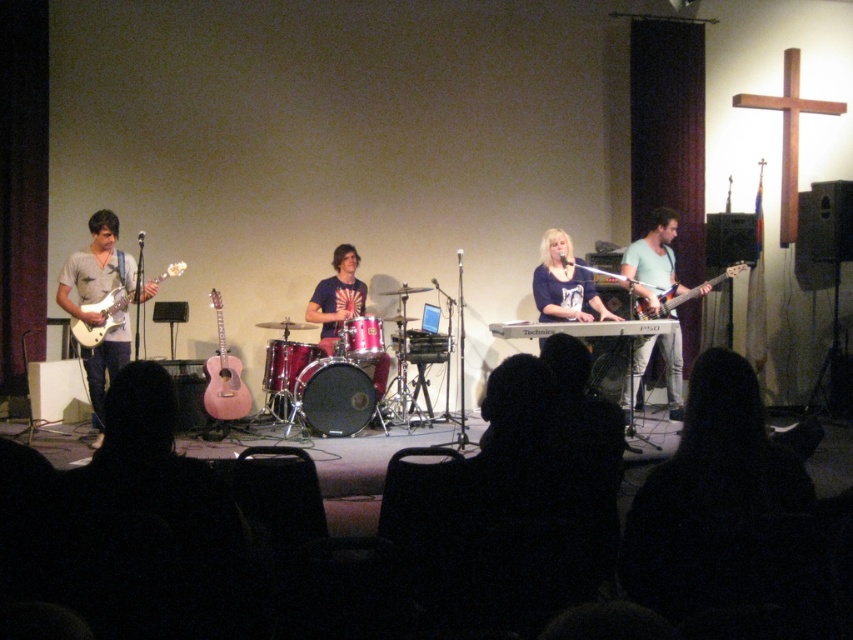
Question: Which object is farther from the camera taking this photo?

Choices:
 (A) white glossy electric guitar at left
 (B) shiny metallic drum at center

Answer: (B)

Question: Can you confirm if matte light blue shirt at right is positioned to the left of pink matte acoustic guitar at center?

Choices:
 (A) yes
 (B) no

Answer: (B)

Question: Estimate the real-world distances between objects in this image. Which object is closer to the white glossy electric guitar at left?

Choices:
 (A) shiny red drum set at center
 (B) matte white guitar at left
 (C) glossy electric guitar at right
 (D) silver metallic keyboard at center

Answer: (B)

Question: Is shiny red drum set at center behind shiny metallic drum at center?

Choices:
 (A) yes
 (B) no

Answer: (A)

Question: Can you confirm if shiny red drum set at center is positioned below glossy electric guitar at right?

Choices:
 (A) no
 (B) yes

Answer: (B)

Question: Which is nearer to the black drumhead at center?

Choices:
 (A) matte white guitar at left
 (B) matte light blue shirt at right

Answer: (A)